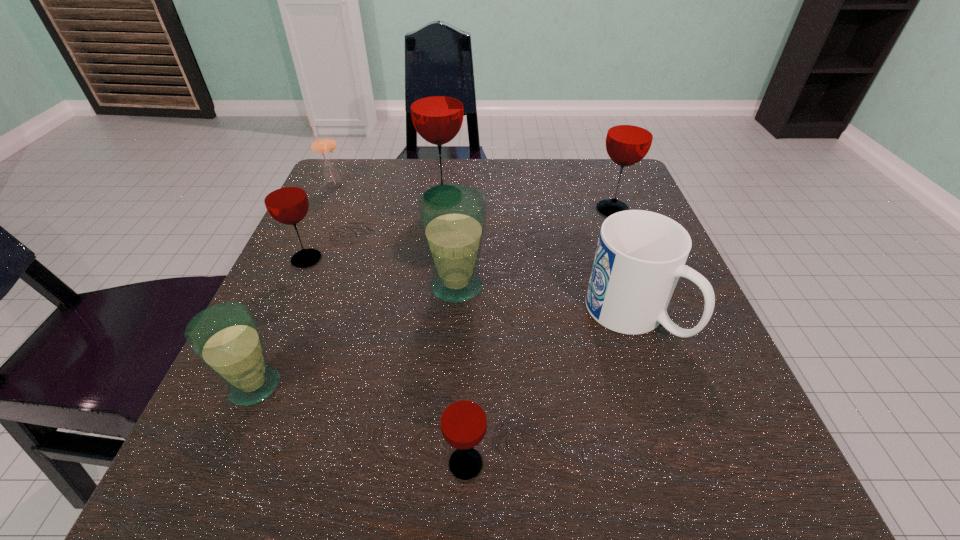
You are a GUI agent. You are given a task and a screenshot of the screen. Output one action in this format:
    pyautogui.click(x=<x>, y=<y>)
    Task: Click on the free space at the near edge of the desktop
    
    Given the screenshot: What is the action you would take?
    pyautogui.click(x=644, y=488)

Find the location of a particular element. vacant space at the left edge is located at coordinates (360, 284).

Identify the location of vacant area at the right edge. (708, 331).

Where is `vacant space at the far left corner of the desktop`? The height and width of the screenshot is (540, 960). vacant space at the far left corner of the desktop is located at coordinates (366, 206).

The image size is (960, 540). I want to click on free region at the near left corner, so click(x=211, y=444).

Find the location of a particular element. The width and height of the screenshot is (960, 540). vacant space at the far right corner of the desktop is located at coordinates (621, 195).

Find the location of `free space between the smaller blue glass and the straw`. free space between the smaller blue glass and the straw is located at coordinates (294, 286).

The width and height of the screenshot is (960, 540). Identify the location of free space that is in between the blue mug and the smallest red glass. (549, 389).

The width and height of the screenshot is (960, 540). In order to click on free space between the smallest red glass and the tallest glass in this screenshot , I will do `click(454, 330)`.

Where is `empty location between the tallest object and the straw`? The height and width of the screenshot is (540, 960). empty location between the tallest object and the straw is located at coordinates (388, 192).